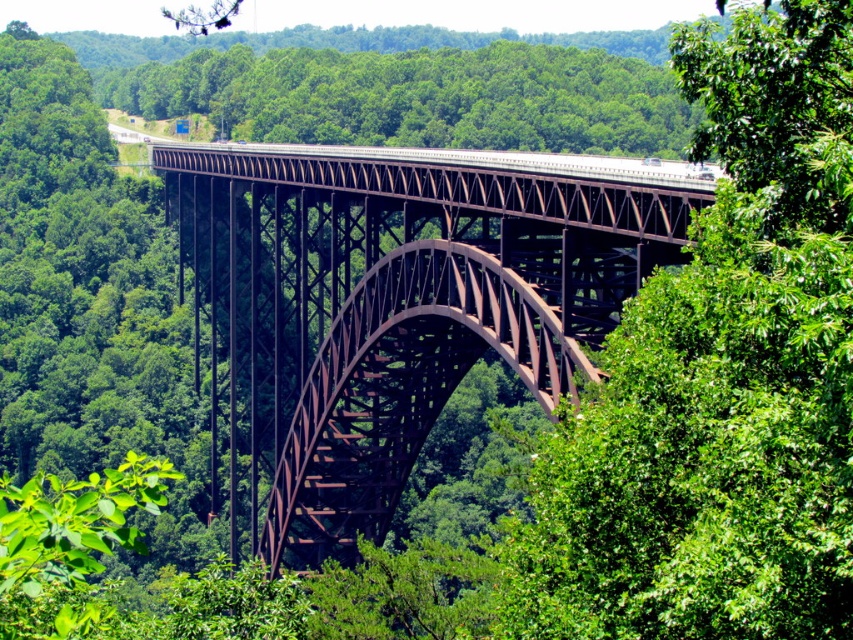
You are a drone operator planning to fly a drone between the green leafy tree at center and the rusty metal arch bridge at center. The drone has a maximum flight distance of 25 meters. Can the drone safely fly between them without exceeding its range?

The distance between the green leafy tree at center and the rusty metal arch bridge at center is 28.82 meters, which exceeds the drone operator maximum flight range of 25 meters. The drone cannot safely fly between them without exceeding its range.

You are standing on the observation deck of the New River Gorge Bridge and notice a green leafy tree at center and a rusty metal arch bridge at center. Which object is closer to you?

The green leafy tree at center is closer to the viewer than the rusty metal arch bridge at center.

You are standing on the New River Gorge Bridge and looking at two points marked on the bridge deck. The first point is at coordinates point (682, 276) and the second is at point (173, 176). Which point is closer to you?

Point (682, 276) is closer to the viewer than point (173, 176).